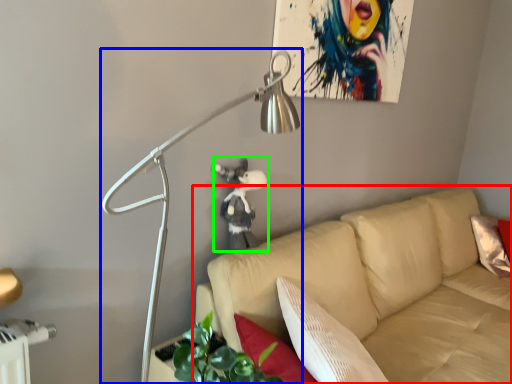
Question: Which object is the closest to the studio couch (highlighted by a red box)? Choose among these: lamp (highlighted by a blue box) or person (highlighted by a green box).

Choices:
 (A) lamp
 (B) person

Answer: (B)